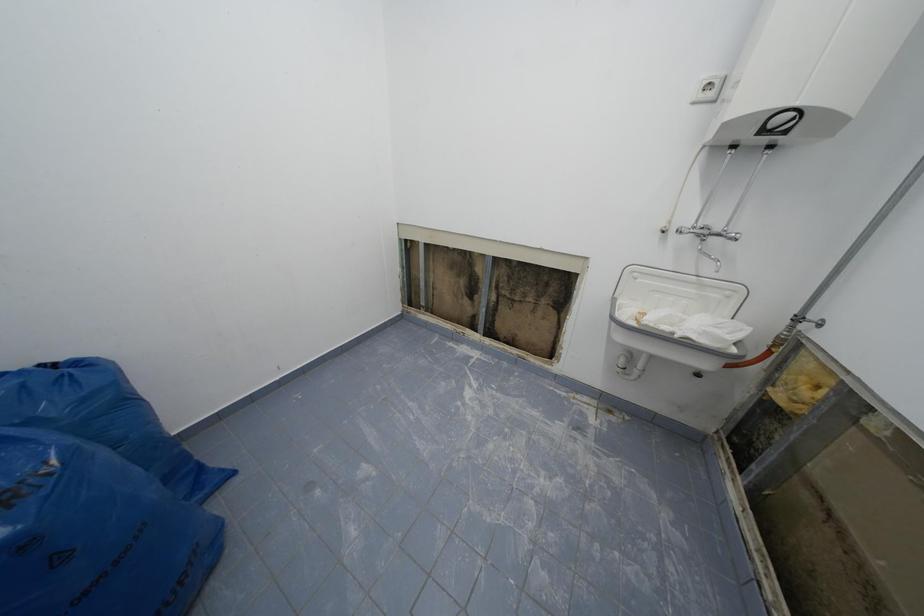
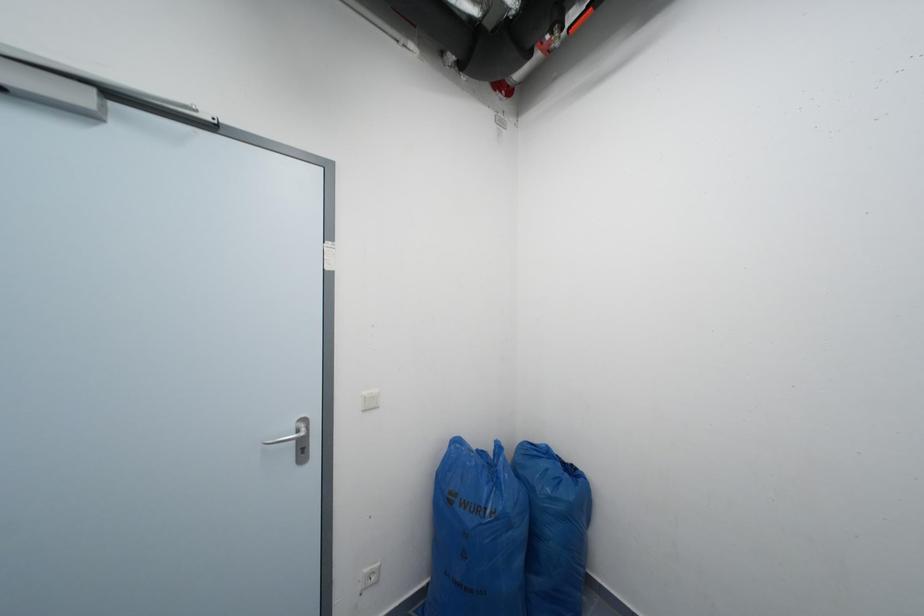
Question: The camera is either moving clockwise (left) or counter-clockwise (right) around the object. The first image is from the beginning of the video and the second image is from the end. Is the camera moving left or right when shooting the video?

Choices:
 (A) Left
 (B) Right

Answer: (B)